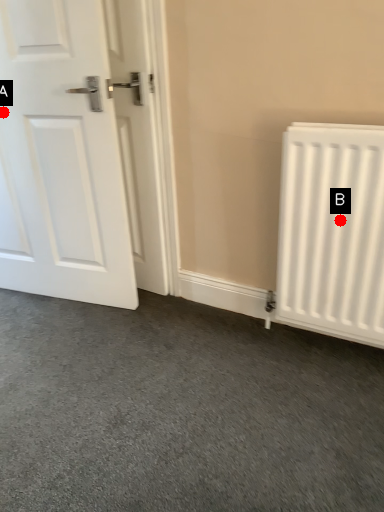
Question: Two points are circled on the image, labeled by A and B beside each circle. Which point is farther from the camera taking this photo?

Choices:
 (A) A is further
 (B) B is further

Answer: (A)